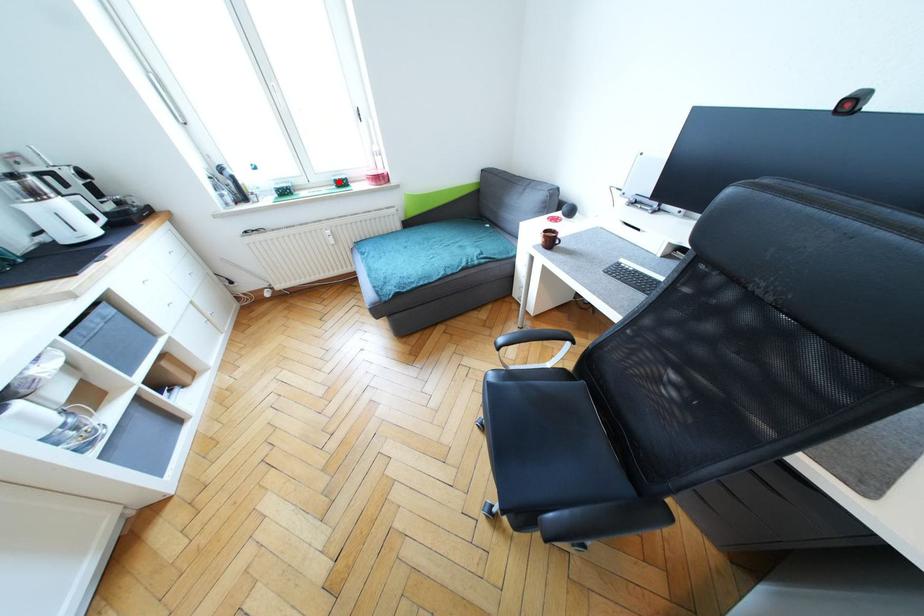
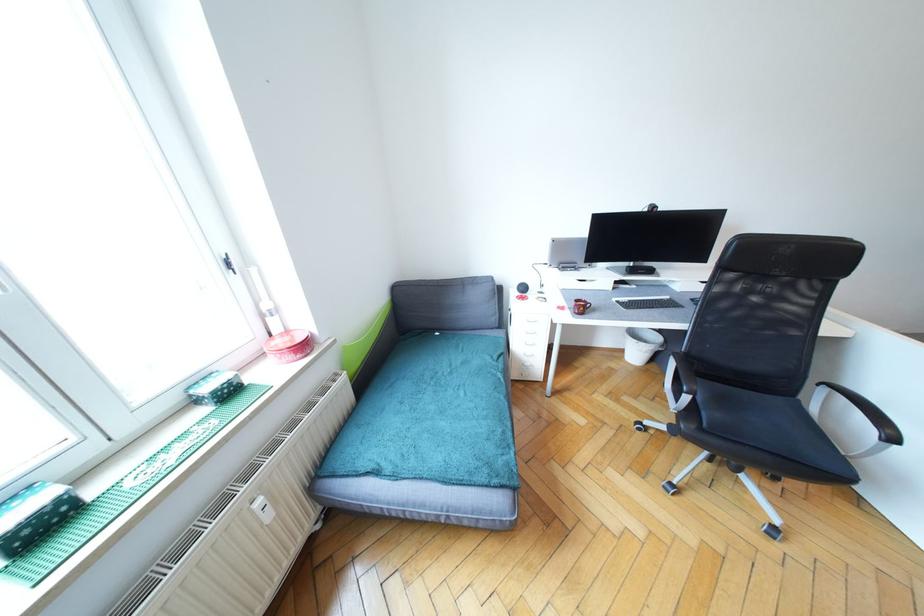
In the second image, find the point that corresponds to the highlighted location in the first image.

(217, 392)